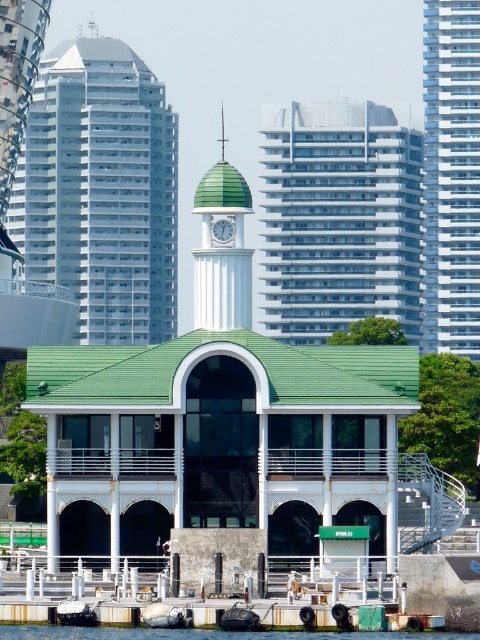
You are a tourist standing at the waterfront and want to take a photo that includes both the white glass building at center and the white glass tower at right. Which one will appear taller in your photo?

The white glass tower at right will appear taller in the photo because it is taller than the white glass building at center.

You are planning to install a new light pole between the white glass clock tower at upper center and the white plastic clock at center. The light pole requires a minimum of 150 meters of space between the two clocks to be installed safely. Can you install the light pole between them?

The white glass clock tower at upper center and the white plastic clock at center are 164.17 meters apart, which is more than the required 150 meters, so yes, the light pole can be installed between them safely.

You are standing at a viewpoint overlooking the waterfront scene. You notice two points marked in the image. Which of these points, point (312, 125) or point (431, 141), is closer to your current position?

Point (312, 125) is closer to the viewer than point (431, 141).